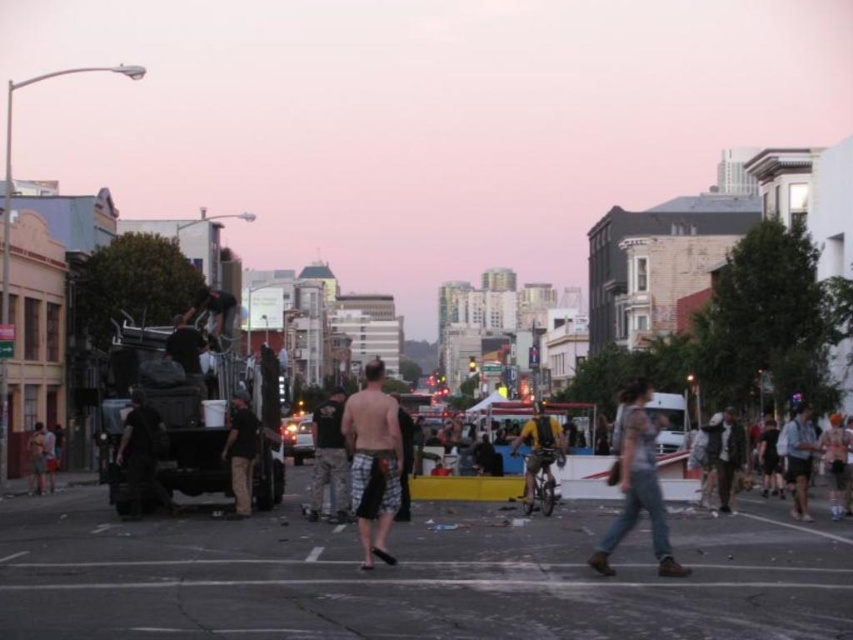
You are a photographer trying to capture a candid shot of two people wearing shorts at the center of the scene. The camera you have can only focus on objects taller than 1.5 meters. Based on the scene, will both the plaid shorts at center and denim shorts at center be in focus?

The plaid shorts at center is not as tall as denim shorts at center. Since the camera requires objects taller than 1.5 meters to be in focus, we need to determine the height of each. If the denim shorts at center is taller than 1.5 meters, it would be in focus, but the plaid shorts at center, being shorter, might not. However, without specific height measurements beyond their relative sizes, we can only confirm that the denim shorts at center is taller than the plaid shorts at center. Thus, if the denim is